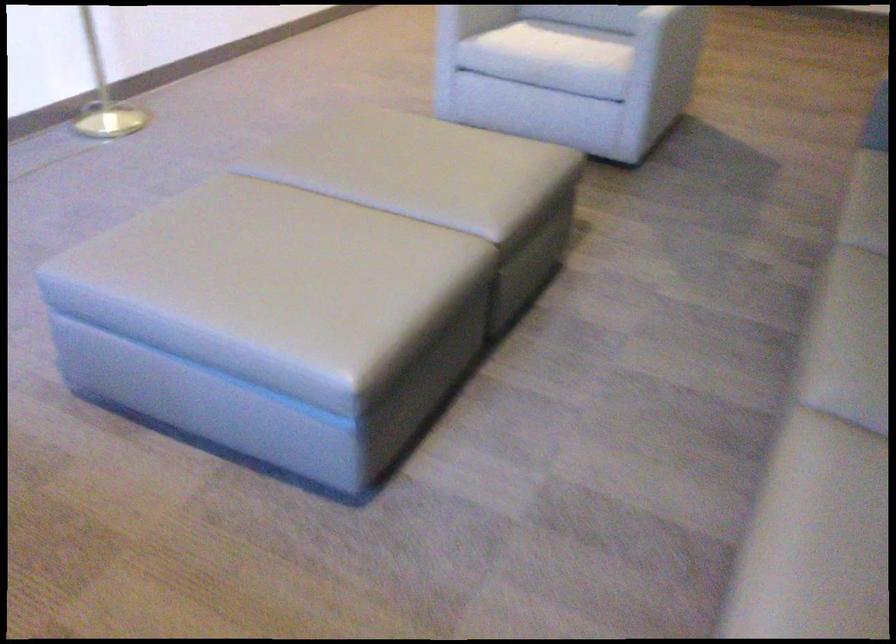
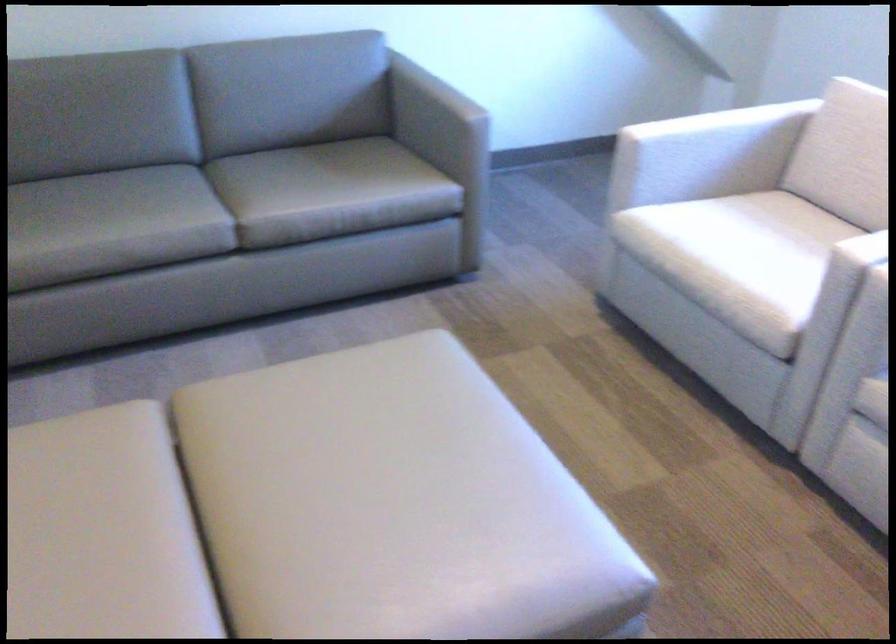
The point at (312,251) is marked in the first image. Where is the corresponding point in the second image?

(348, 446)